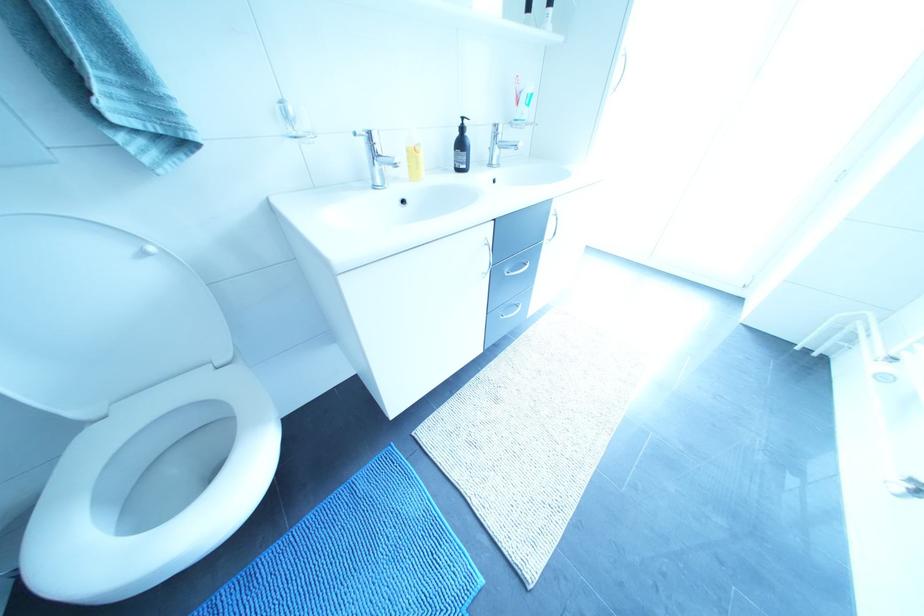
Identify the location of silver drawer handle. This screenshot has height=616, width=924. (499, 248).